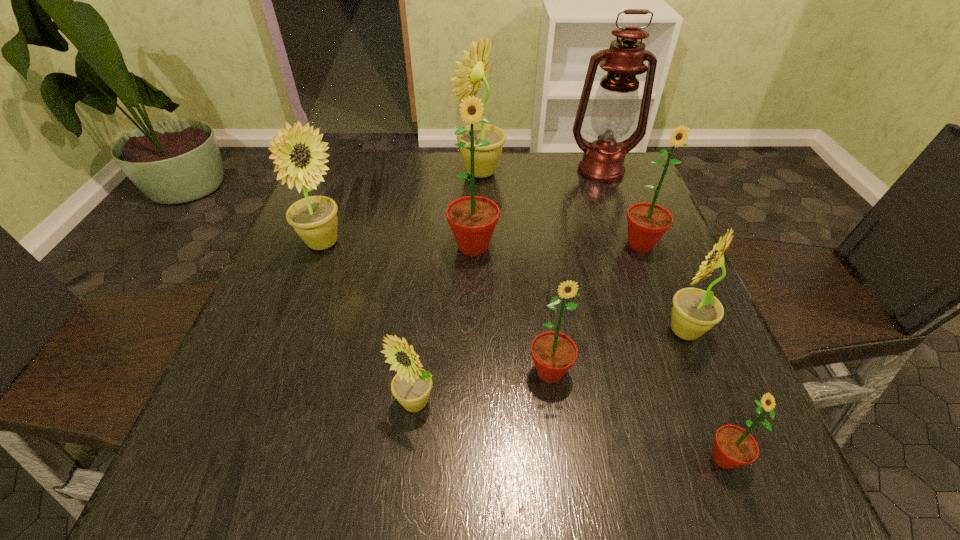
I want to click on sunflower situated at the far edge, so click(x=471, y=76).

Where is `object at the near edge`? Image resolution: width=960 pixels, height=540 pixels. object at the near edge is located at coordinates (734, 446).

Locate an element on the screen. Image resolution: width=960 pixels, height=540 pixels. object positioned at the left edge is located at coordinates (314, 219).

Find the location of a particular element. oil lamp present at the right edge is located at coordinates (615, 104).

You are a GUI agent. You are given a task and a screenshot of the screen. Output one action in this format:
    pyautogui.click(x=<x>, y=<y>)
    Task: Click on the object situated at the far right corner
    
    Given the screenshot: What is the action you would take?
    pyautogui.click(x=615, y=104)

Find the location of a particular element. The width and height of the screenshot is (960, 540). object situated at the near right corner is located at coordinates (734, 446).

Image resolution: width=960 pixels, height=540 pixels. In the image, there is a desktop. Identify the location of vacant space at the far edge. (525, 164).

This screenshot has width=960, height=540. Find the location of `free space at the near edge`. free space at the near edge is located at coordinates (627, 443).

This screenshot has height=540, width=960. I want to click on vacant space at the left edge of the desktop, so click(x=341, y=266).

In the image, there is a desktop. At what (x,y) coordinates should I click in order to perform the action: click on vacant space at the right edge. Please return your answer as a coordinate pair (x, y). Looking at the image, I should click on (661, 262).